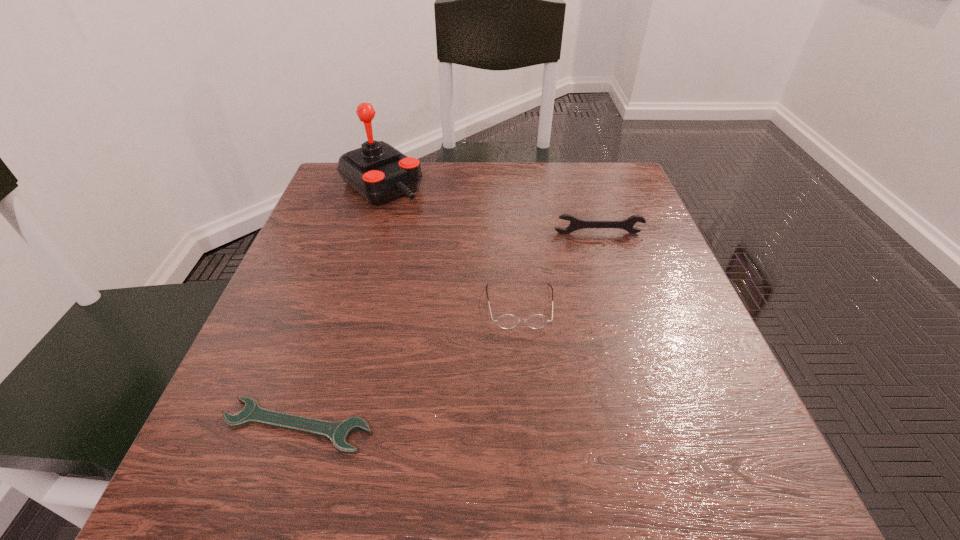
Find the location of a particular element. The height and width of the screenshot is (540, 960). the tallest object is located at coordinates (377, 171).

Locate an element on the screen. Image resolution: width=960 pixels, height=540 pixels. the farthest object is located at coordinates (377, 171).

Locate an element on the screen. the rightmost object is located at coordinates (575, 224).

Where is `the taller wrench`? The image size is (960, 540). the taller wrench is located at coordinates (575, 224).

Where is `the third farthest object`? Image resolution: width=960 pixels, height=540 pixels. the third farthest object is located at coordinates (507, 321).

Identify the location of spectacles. This screenshot has height=540, width=960. (507, 321).

The height and width of the screenshot is (540, 960). I want to click on the nearest object, so click(338, 432).

You are a GUI agent. You are given a task and a screenshot of the screen. Output one action in this format:
    pyautogui.click(x=<x>, y=<y>)
    Task: Click on the left wrench
    
    Given the screenshot: What is the action you would take?
    pyautogui.click(x=338, y=432)

Find the location of a particular element. vacant space located on the front of the joystick is located at coordinates (339, 324).

Image resolution: width=960 pixels, height=540 pixels. Identify the location of vacant area situated 0.150m on the open ends of the taller wrench. (613, 282).